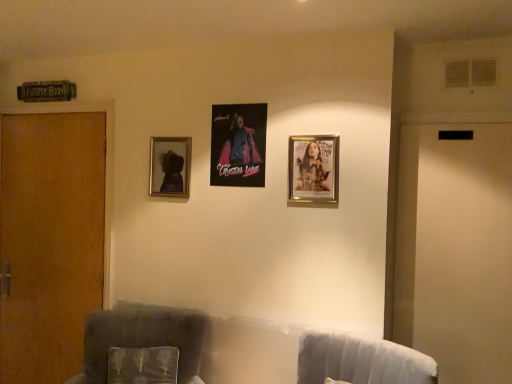
Question: From the image's perspective, is velvet dark gray armchair at left above gold metallic picture frame at upper right, which is counted as the 3th picture frame, starting from the left?

Choices:
 (A) no
 (B) yes

Answer: (A)

Question: Is velvet dark gray armchair at left far from gold metallic picture frame at upper right, which is counted as the 3th picture frame, starting from the left?

Choices:
 (A) yes
 (B) no

Answer: (A)

Question: Considering the relative sizes of velvet dark gray armchair at left and gold metallic picture frame at upper right, which appears as the 1th picture frame when viewed from the front, in the image provided, is velvet dark gray armchair at left shorter than gold metallic picture frame at upper right, which appears as the 1th picture frame when viewed from the front,?

Choices:
 (A) no
 (B) yes

Answer: (A)

Question: Does velvet dark gray armchair at left have a greater width compared to gold metallic picture frame at upper right, which is the first picture frame from right to left?

Choices:
 (A) no
 (B) yes

Answer: (B)

Question: Is gold metallic picture frame at upper right, which is the first picture frame from right to left, located within velvet dark gray armchair at left?

Choices:
 (A) no
 (B) yes

Answer: (A)

Question: Is velvety green pillow at lower left taller or shorter than velvet gray swivel chair at lower right?

Choices:
 (A) tall
 (B) short

Answer: (A)

Question: Which is correct: velvety green pillow at lower left is inside velvet gray swivel chair at lower right, or outside of it?

Choices:
 (A) outside
 (B) inside

Answer: (A)

Question: Considering the positions of point [x=162, y=354] and point [x=433, y=367], is point [x=162, y=354] closer or farther from the camera than point [x=433, y=367]?

Choices:
 (A) closer
 (B) farther

Answer: (B)

Question: Is velvety green pillow at lower left in front of or behind velvet gray swivel chair at lower right in the image?

Choices:
 (A) behind
 (B) front

Answer: (A)

Question: Is metallic poster at center, which is counted as the second picture frame, starting from the left, taller or shorter than velvet dark gray armchair at left?

Choices:
 (A) short
 (B) tall

Answer: (A)

Question: From the image's perspective, is metallic poster at center, which is counted as the second picture frame, starting from the left, located above or below velvet dark gray armchair at left?

Choices:
 (A) above
 (B) below

Answer: (A)

Question: From a real-world perspective, is metallic poster at center, which is counted as the second picture frame, starting from the left, physically located above or below velvet dark gray armchair at left?

Choices:
 (A) below
 (B) above

Answer: (B)

Question: Considering the positions of point (258, 158) and point (86, 324), is point (258, 158) closer or farther from the camera than point (86, 324)?

Choices:
 (A) closer
 (B) farther

Answer: (A)

Question: In terms of width, does velvet gray swivel chair at lower right look wider or thinner when compared to velvety green pillow at lower left?

Choices:
 (A) thin
 (B) wide

Answer: (B)

Question: From the image's perspective, is velvet gray swivel chair at lower right located above or below velvety green pillow at lower left?

Choices:
 (A) below
 (B) above

Answer: (B)